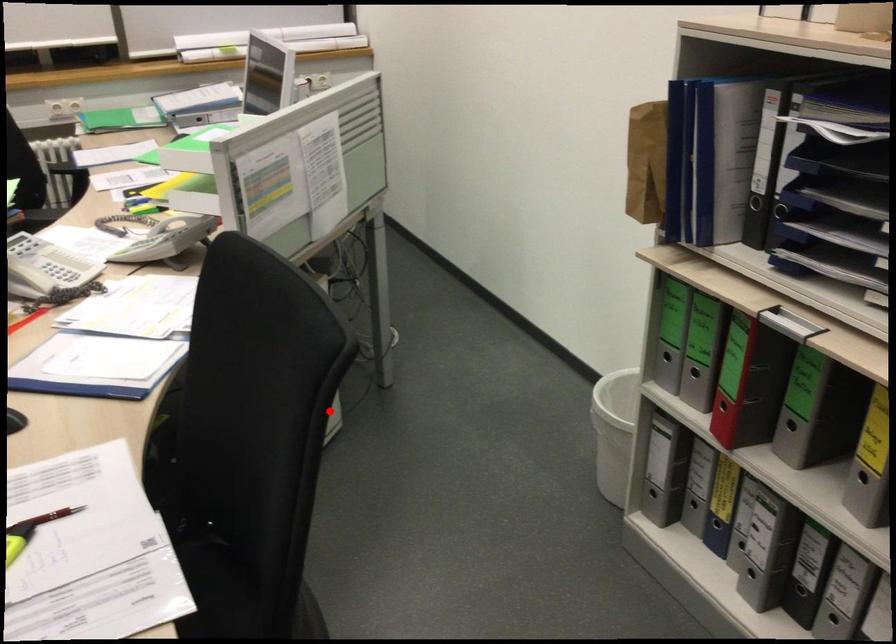
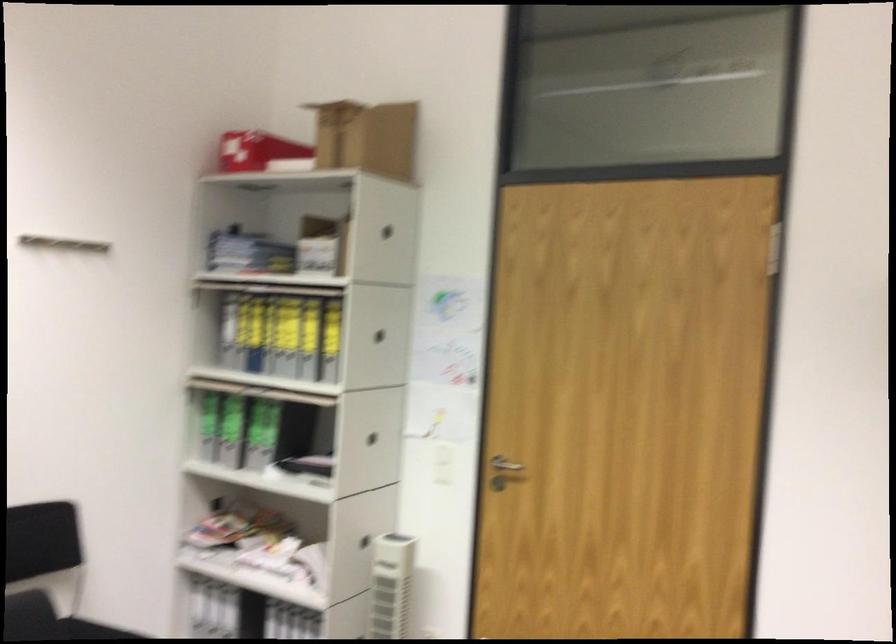
The point at the highlighted location is marked in the first image. Where is the corresponding point in the second image?

(48, 621)